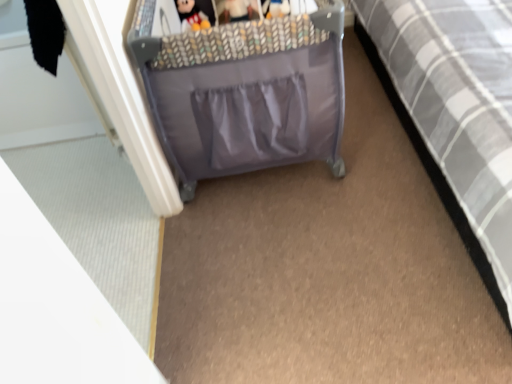
Identify the location of gray fabric bed at right. Image resolution: width=512 pixels, height=384 pixels. (458, 103).

Describe the element at coordinates (458, 103) in the screenshot. Image resolution: width=512 pixels, height=384 pixels. I see `gray fabric bed at right` at that location.

What is the approximate width of gray fabric bed at right?

gray fabric bed at right is 6.98 feet in width.

Measure the distance between point (x=492, y=263) and camera.

Point (x=492, y=263) and camera are 3.96 feet apart.

What is the approximate width of plush fabric plushie at upper center?

It is 19.97 centimeters.

What is the approximate height of plush fabric plushie at upper center?

The height of plush fabric plushie at upper center is 9.68 inches.

In order to click on plush fabric plushie at upper center in this screenshot , I will do click(x=190, y=14).

What do you see at coordinates (190, 14) in the screenshot? Image resolution: width=512 pixels, height=384 pixels. I see `plush fabric plushie at upper center` at bounding box center [190, 14].

Locate an element on the screen. gray fabric bed at right is located at coordinates (458, 103).

Considering the positions of objects plush fabric plushie at upper center and gray fabric bed at right in the image provided, who is more to the right, plush fabric plushie at upper center or gray fabric bed at right?

Positioned to the right is gray fabric bed at right.

Considering the relative positions of plush fabric plushie at upper center and gray fabric bed at right in the image provided, is plush fabric plushie at upper center in front of gray fabric bed at right?

No, the depth of plush fabric plushie at upper center is greater than that of gray fabric bed at right.

Which is further, (194,6) or (395,34)?

The point (395,34) is farther.

From the image's perspective, would you say plush fabric plushie at upper center is shown under gray fabric bed at right?

No, from the image's perspective, plush fabric plushie at upper center is not beneath gray fabric bed at right.

From a real-world perspective, which object stands above the other?

gray fabric bed at right, from a real-world perspective.

Which object is wider, plush fabric plushie at upper center or gray fabric bed at right?

With larger width is gray fabric bed at right.

Is plush fabric plushie at upper center taller or shorter than gray fabric bed at right?

In the image, plush fabric plushie at upper center appears to be shorter than gray fabric bed at right.

Consider the image. Considering the sizes of plush fabric plushie at upper center and gray fabric bed at right in the image, is plush fabric plushie at upper center bigger or smaller than gray fabric bed at right?

plush fabric plushie at upper center is smaller than gray fabric bed at right.

Is gray fabric bed at right a part of plush fabric plushie at upper center?

No, gray fabric bed at right is not inside plush fabric plushie at upper center.

Is plush fabric plushie at upper center directly adjacent to gray fabric bed at right?

No, plush fabric plushie at upper center is not with gray fabric bed at right.

Could you tell me if plush fabric plushie at upper center is turned towards gray fabric bed at right?

No, plush fabric plushie at upper center is not turned towards gray fabric bed at right.

How different are the orientations of plush fabric plushie at upper center and gray fabric bed at right in degrees?

The angle between the facing direction of plush fabric plushie at upper center and the facing direction of gray fabric bed at right is 3.24 degrees.

Where is `toy on the left of the gray fabric bed at right`? The width and height of the screenshot is (512, 384). toy on the left of the gray fabric bed at right is located at coordinates (190, 14).

Considering the relative positions of gray fabric bed at right and plush fabric plushie at upper center in the image provided, is gray fabric bed at right to the left or to the right of plush fabric plushie at upper center?

Based on their positions, gray fabric bed at right is located to the right of plush fabric plushie at upper center.

Which object is further away from the camera taking this photo, gray fabric bed at right or plush fabric plushie at upper center?

plush fabric plushie at upper center is further away from the camera.

Considering the positions of point (460, 87) and point (187, 15), is point (460, 87) closer or farther from the camera than point (187, 15)?

Point (460, 87) appears to be farther away from the viewer than point (187, 15).

From the image's perspective, which one is positioned lower, gray fabric bed at right or plush fabric plushie at upper center?

gray fabric bed at right.

From a real-world perspective, is gray fabric bed at right physically located above or below plush fabric plushie at upper center?

From a real-world perspective, gray fabric bed at right is physically above plush fabric plushie at upper center.

Is gray fabric bed at right wider or thinner than plush fabric plushie at upper center?

In the image, gray fabric bed at right appears to be wider than plush fabric plushie at upper center.

In the scene shown: Which of these two, gray fabric bed at right or plush fabric plushie at upper center, stands shorter?

plush fabric plushie at upper center is shorter.

Between gray fabric bed at right and plush fabric plushie at upper center, which one has larger size?

gray fabric bed at right.

Do you think gray fabric bed at right is within plush fabric plushie at upper center, or outside of it?

gray fabric bed at right lies outside plush fabric plushie at upper center.

Are gray fabric bed at right and plush fabric plushie at upper center far apart?

gray fabric bed at right is near plush fabric plushie at upper center, not far away.

Does gray fabric bed at right turn towards plush fabric plushie at upper center?

No, gray fabric bed at right is not aimed at plush fabric plushie at upper center.

Find the location of `toy on the left of gray fabric bed at right`. toy on the left of gray fabric bed at right is located at coordinates (190, 14).

Locate an element on the screen. The width and height of the screenshot is (512, 384). toy below the gray fabric bed at right (from a real-world perspective) is located at coordinates point(190,14).

In the image, there is a plush fabric plushie at upper center. Where is `furniture below it (from the image's perspective)`? furniture below it (from the image's perspective) is located at coordinates (458, 103).